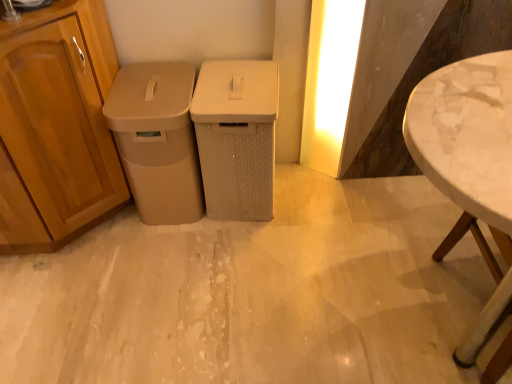
Question: From the image's perspective, is beige textured waste bin at center, positioned as the 1th waste container in right-to-left order, below white marble table at right?

Choices:
 (A) yes
 (B) no

Answer: (B)

Question: Is beige textured waste bin at center, positioned as the 1th waste container in right-to-left order, taller than white marble table at right?

Choices:
 (A) no
 (B) yes

Answer: (A)

Question: Is beige textured waste bin at center, which appears as the second waste container when viewed from the left, to the right of white marble table at right from the viewer's perspective?

Choices:
 (A) no
 (B) yes

Answer: (A)

Question: Would you say beige textured waste bin at center, positioned as the 1th waste container in right-to-left order, is outside white marble table at right?

Choices:
 (A) yes
 (B) no

Answer: (A)

Question: Is beige textured waste bin at center, positioned as the 1th waste container in right-to-left order, bigger than white marble table at right?

Choices:
 (A) no
 (B) yes

Answer: (A)

Question: From a real-world perspective, is yellow matte light at upper right above or below beige matte trash can at left, positioned as the first waste container in left-to-right order?

Choices:
 (A) below
 (B) above

Answer: (B)

Question: Considering their positions, is yellow matte light at upper right located in front of or behind beige matte trash can at left, positioned as the first waste container in left-to-right order?

Choices:
 (A) front
 (B) behind

Answer: (B)

Question: In the image, is yellow matte light at upper right on the left side or the right side of beige matte trash can at left, positioned as the first waste container in left-to-right order?

Choices:
 (A) left
 (B) right

Answer: (B)

Question: Is yellow matte light at upper right inside or outside of beige matte trash can at left, which appears as the 2th waste container when viewed from the right?

Choices:
 (A) inside
 (B) outside

Answer: (B)

Question: Does point (343, 6) appear closer or farther from the camera than point (426, 99)?

Choices:
 (A) closer
 (B) farther

Answer: (B)

Question: Is yellow matte light at upper right to the left or to the right of white marble table at right in the image?

Choices:
 (A) left
 (B) right

Answer: (A)

Question: From a real-world perspective, is yellow matte light at upper right positioned above or below white marble table at right?

Choices:
 (A) above
 (B) below

Answer: (B)

Question: In terms of width, does yellow matte light at upper right look wider or thinner when compared to white marble table at right?

Choices:
 (A) wide
 (B) thin

Answer: (B)

Question: Considering the positions of beige textured waste bin at center, positioned as the 1th waste container in right-to-left order, and yellow matte light at upper right in the image, is beige textured waste bin at center, positioned as the 1th waste container in right-to-left order, bigger or smaller than yellow matte light at upper right?

Choices:
 (A) small
 (B) big

Answer: (B)

Question: From the image's perspective, is beige textured waste bin at center, positioned as the 1th waste container in right-to-left order, above or below yellow matte light at upper right?

Choices:
 (A) below
 (B) above

Answer: (A)